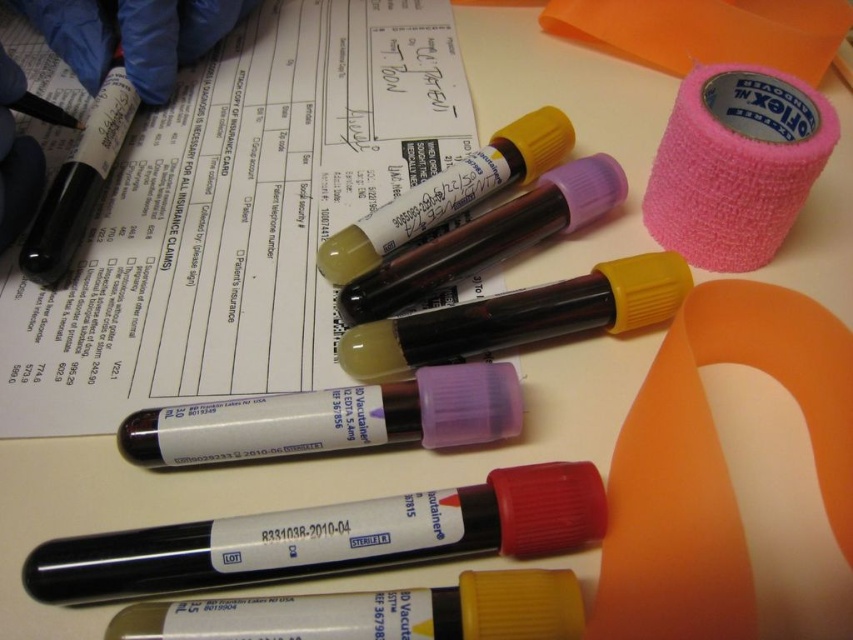
Does white paper at center have a larger size compared to matte black pen at lower center?

Yes, white paper at center is bigger than matte black pen at lower center.

Does white paper at center appear over matte black pen at lower center?

Yes, white paper at center is above matte black pen at lower center.

Is point (158, 330) more distant than point (399, 520)?

Yes, it is.

The width and height of the screenshot is (853, 640). Identify the location of white paper at center. (236, 216).

Does matte black pen at lower center have a greater height compared to pink fabric tape at upper right?

No.

Looking at this image, which of these two, matte black pen at lower center or pink fabric tape at upper right, stands shorter?

Standing shorter between the two is matte black pen at lower center.

Identify the location of matte black pen at lower center. (328, 538).

Can you confirm if white paper at center is positioned to the left of pink fabric tape at upper right?

Yes, white paper at center is to the left of pink fabric tape at upper right.

Who is more distant from viewer, (x=64, y=346) or (x=755, y=120)?

The point (x=755, y=120) is more distant.

Between point (202, 211) and point (779, 237), which one is positioned behind?

The point (202, 211) is more distant.

The width and height of the screenshot is (853, 640). Find the location of `white paper at center`. white paper at center is located at coordinates (236, 216).